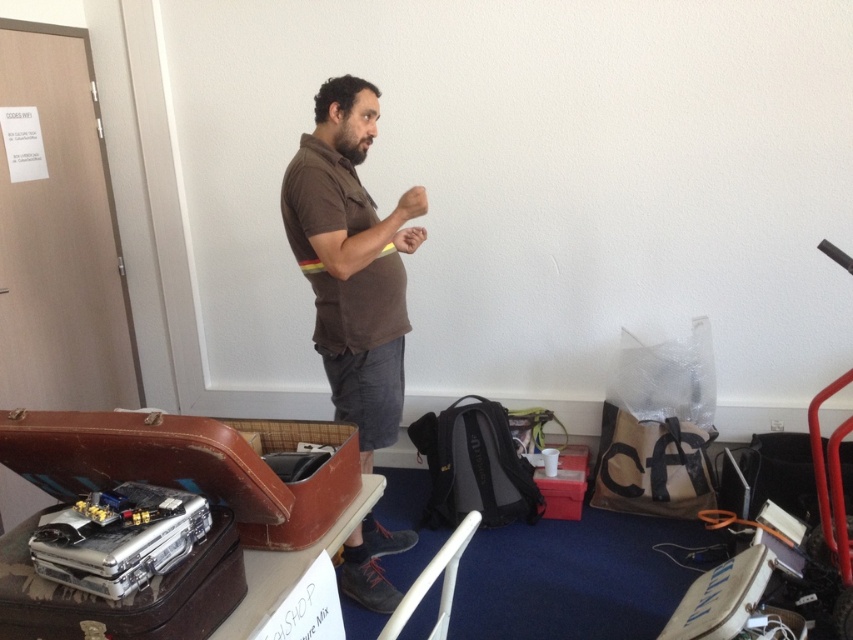
From the picture: Is brown cotton shirt at center thinner than silver metallic briefcase at lower left?

No.

Is brown cotton shirt at center shorter than silver metallic briefcase at lower left?

In fact, brown cotton shirt at center may be taller than silver metallic briefcase at lower left.

Between point (364, 192) and point (202, 561), which one is positioned behind?

The point (364, 192) is more distant.

Find the location of a particular element. brown cotton shirt at center is located at coordinates (352, 260).

Between brown cotton shirt at center and metallic suitcase at lower left, which one appears on the left side from the viewer's perspective?

Positioned to the left is metallic suitcase at lower left.

Which of these two, brown cotton shirt at center or metallic suitcase at lower left, stands taller?

With more height is brown cotton shirt at center.

Which is behind, point (355, 156) or point (161, 460)?

Point (355, 156)

In order to click on brown cotton shirt at center in this screenshot , I will do point(352,260).

Is metallic suitcase at lower left to the left of silver metallic briefcase at lower left from the viewer's perspective?

Incorrect, metallic suitcase at lower left is not on the left side of silver metallic briefcase at lower left.

Looking at this image, does metallic suitcase at lower left lie in front of silver metallic briefcase at lower left?

That is False.

Does point (242, 472) come closer to viewer compared to point (68, 620)?

That is False.

In order to click on metallic suitcase at lower left in this screenshot , I will do `click(206, 481)`.